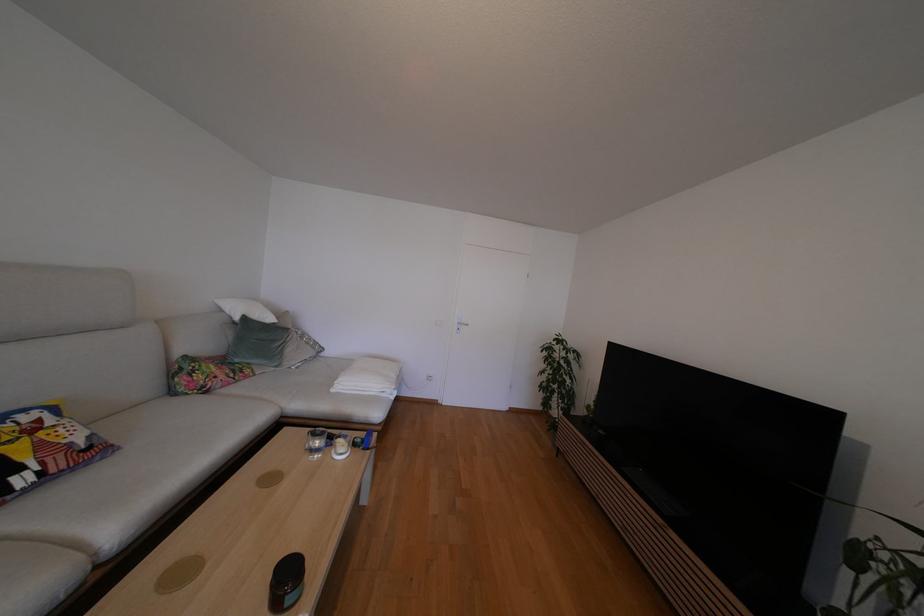
What do you see at coordinates (71, 436) in the screenshot? I see `a sofa sitting surface` at bounding box center [71, 436].